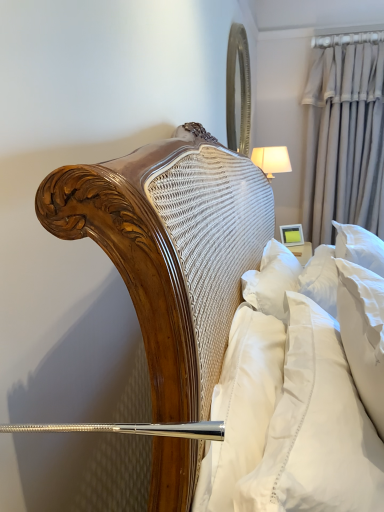
Question: From the image's perspective, would you say matte yellow picture frame at upper right is positioned over beige fabric curtain at upper right?

Choices:
 (A) yes
 (B) no

Answer: (B)

Question: Can you confirm if matte yellow picture frame at upper right is wider than beige fabric curtain at upper right?

Choices:
 (A) yes
 (B) no

Answer: (B)

Question: Considering the relative sizes of matte yellow picture frame at upper right and beige fabric curtain at upper right in the image provided, is matte yellow picture frame at upper right bigger than beige fabric curtain at upper right?

Choices:
 (A) yes
 (B) no

Answer: (B)

Question: Is matte yellow picture frame at upper right not near beige fabric curtain at upper right?

Choices:
 (A) no
 (B) yes

Answer: (A)

Question: Considering the relative sizes of matte yellow picture frame at upper right and beige fabric curtain at upper right in the image provided, is matte yellow picture frame at upper right taller than beige fabric curtain at upper right?

Choices:
 (A) no
 (B) yes

Answer: (A)

Question: Is matte yellow picture frame at upper right spatially inside beige fabric curtain at upper right, or outside of it?

Choices:
 (A) outside
 (B) inside

Answer: (A)

Question: Considering the positions of point (281, 241) and point (319, 199), is point (281, 241) closer or farther from the camera than point (319, 199)?

Choices:
 (A) farther
 (B) closer

Answer: (B)

Question: In terms of width, does matte yellow picture frame at upper right look wider or thinner when compared to beige fabric curtain at upper right?

Choices:
 (A) thin
 (B) wide

Answer: (A)

Question: From the image's perspective, is matte yellow picture frame at upper right positioned above or below beige fabric curtain at upper right?

Choices:
 (A) above
 (B) below

Answer: (B)

Question: Is matte yellow picture frame at upper right bigger or smaller than white fabric lampshade at upper right?

Choices:
 (A) small
 (B) big

Answer: (A)

Question: In terms of width, does matte yellow picture frame at upper right look wider or thinner when compared to white fabric lampshade at upper right?

Choices:
 (A) thin
 (B) wide

Answer: (A)

Question: From a real-world perspective, relative to white fabric lampshade at upper right, is matte yellow picture frame at upper right vertically above or below?

Choices:
 (A) above
 (B) below

Answer: (B)

Question: In terms of height, does matte yellow picture frame at upper right look taller or shorter compared to white fabric lampshade at upper right?

Choices:
 (A) tall
 (B) short

Answer: (B)

Question: Based on their positions, is beige fabric curtain at upper right located to the left or right of matte yellow picture frame at upper right?

Choices:
 (A) right
 (B) left

Answer: (A)

Question: Is point (324, 177) positioned closer to the camera than point (302, 237)?

Choices:
 (A) closer
 (B) farther

Answer: (A)